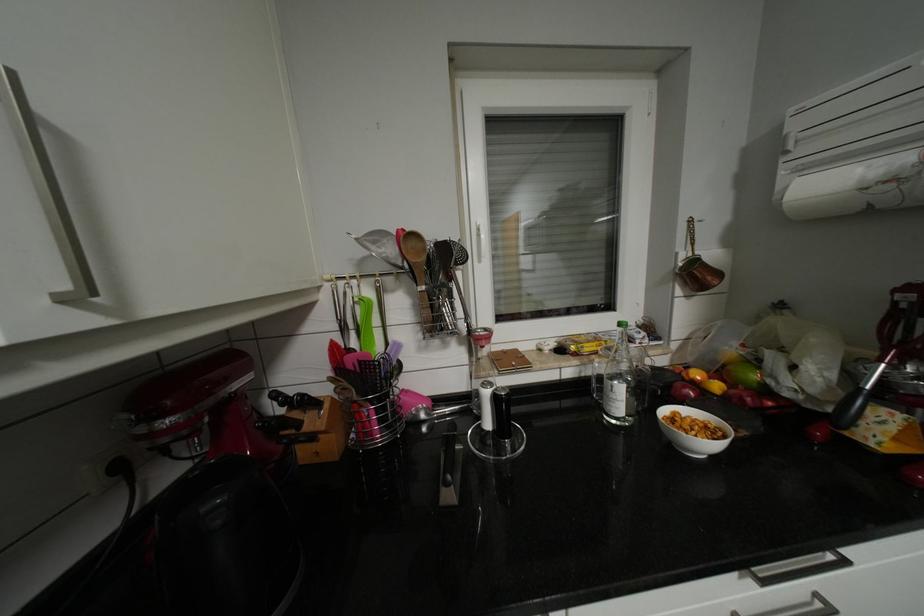
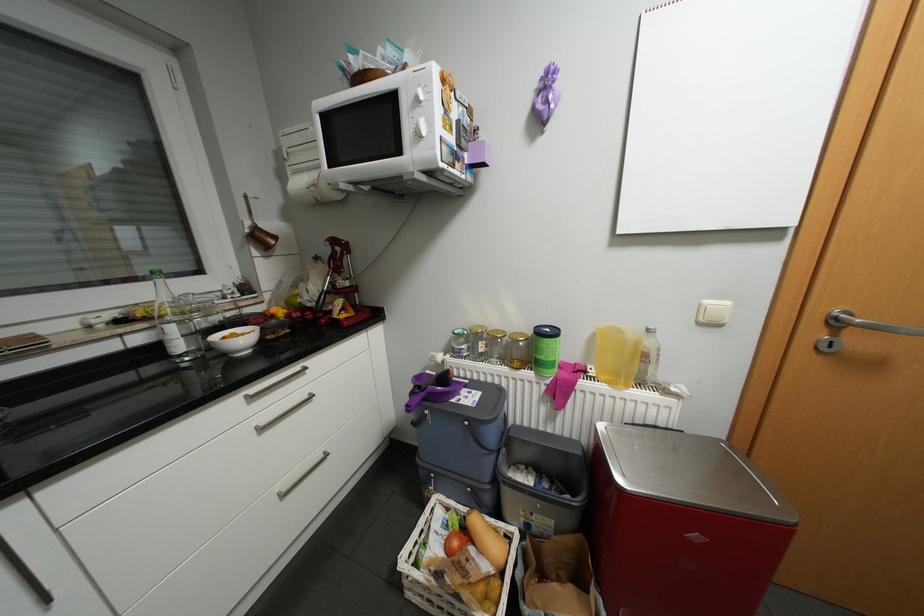
Find the pixel in the second image that matches point 690,254 in the first image.

(256, 223)